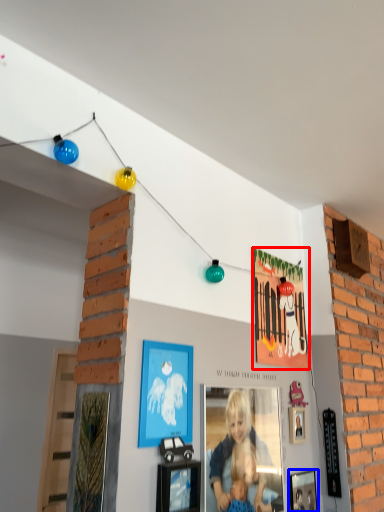
Question: Which point is closer to the camera, picture frame (highlighted by a red box) or picture frame (highlighted by a blue box)?

Choices:
 (A) picture frame
 (B) picture frame

Answer: (B)